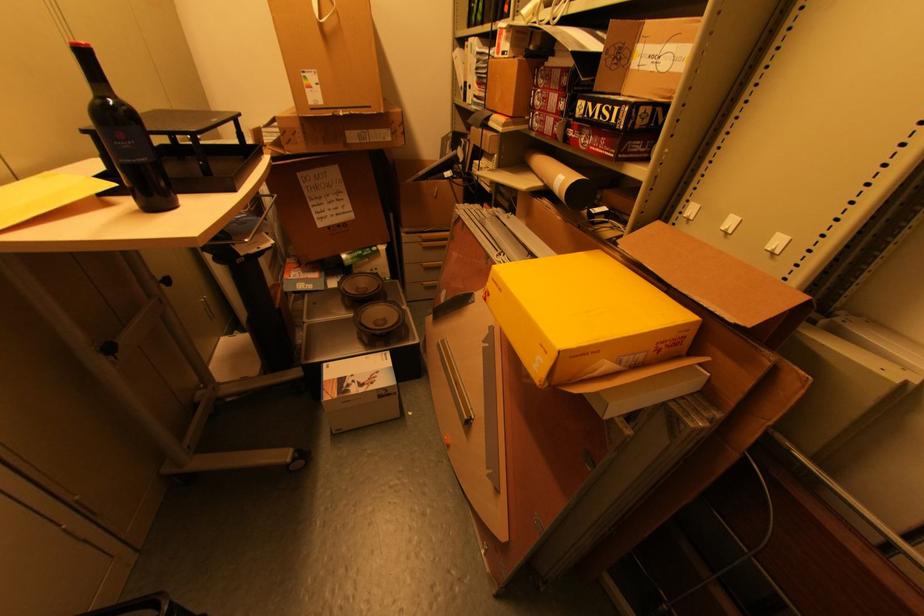
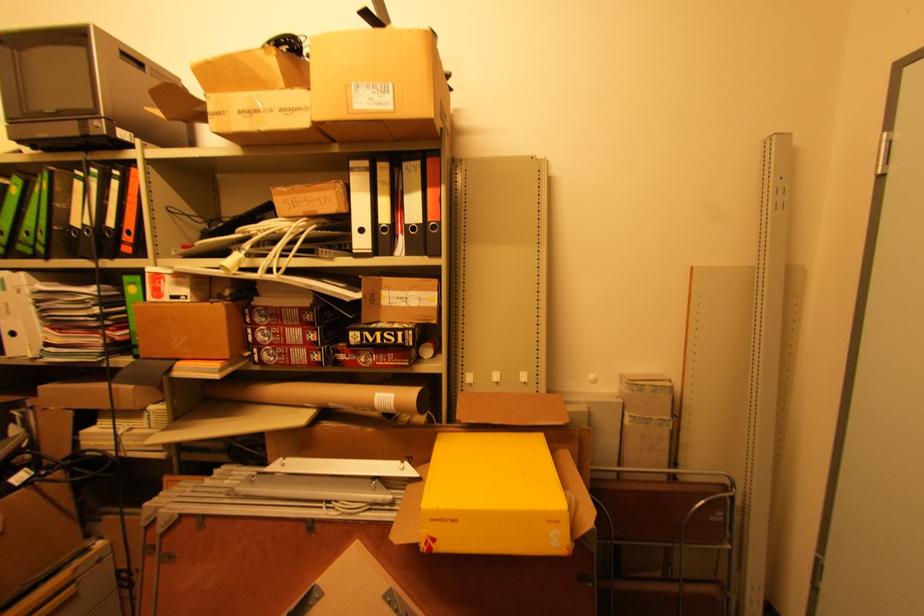
Where in the second image is the point corresponding to (x=499, y=284) from the first image?

(444, 521)